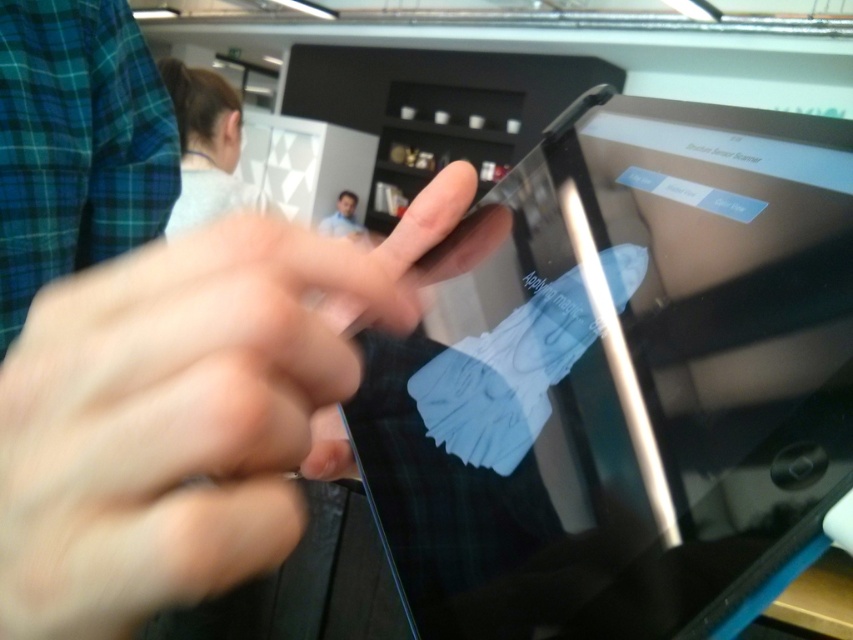
Between black glossy tablet at center and blue matte face at upper center, which one appears on the left side from the viewer's perspective?

blue matte face at upper center

Can you confirm if black glossy tablet at center is positioned above blue matte face at upper center?

Incorrect, black glossy tablet at center is not positioned above blue matte face at upper center.

The height and width of the screenshot is (640, 853). In order to click on black glossy tablet at center in this screenshot , I will do [622, 380].

Is matte black finger at center thinner than blue matte face at upper center?

Indeed, matte black finger at center has a lesser width compared to blue matte face at upper center.

Which of these two, matte black finger at center or blue matte face at upper center, stands taller?

blue matte face at upper center is taller.

Where is `matte black finger at center`? This screenshot has height=640, width=853. matte black finger at center is located at coordinates (184, 412).

How much distance is there between black glossy tablet at center and matte black finger at center?

The distance of black glossy tablet at center from matte black finger at center is 9.52 centimeters.

Where is `black glossy tablet at center`? black glossy tablet at center is located at coordinates (622, 380).